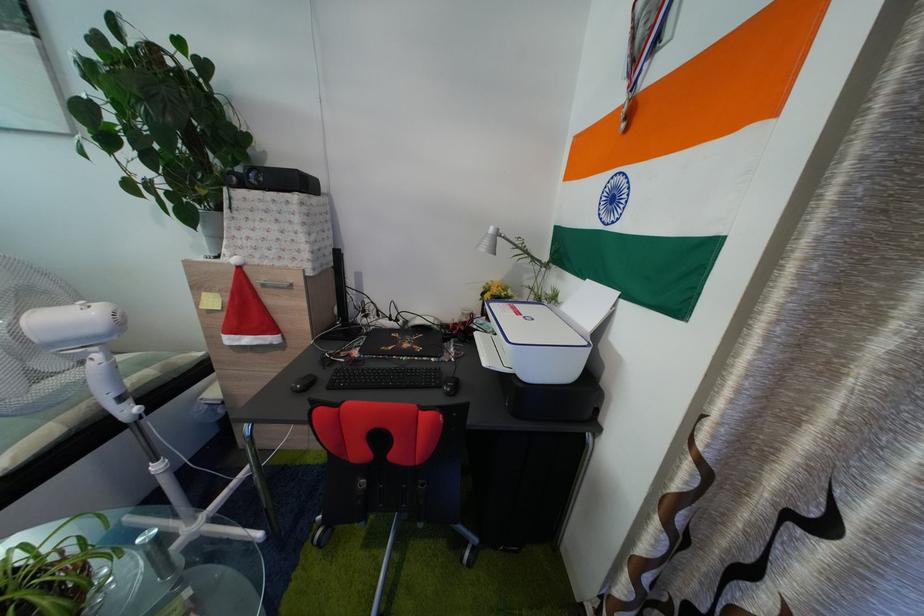
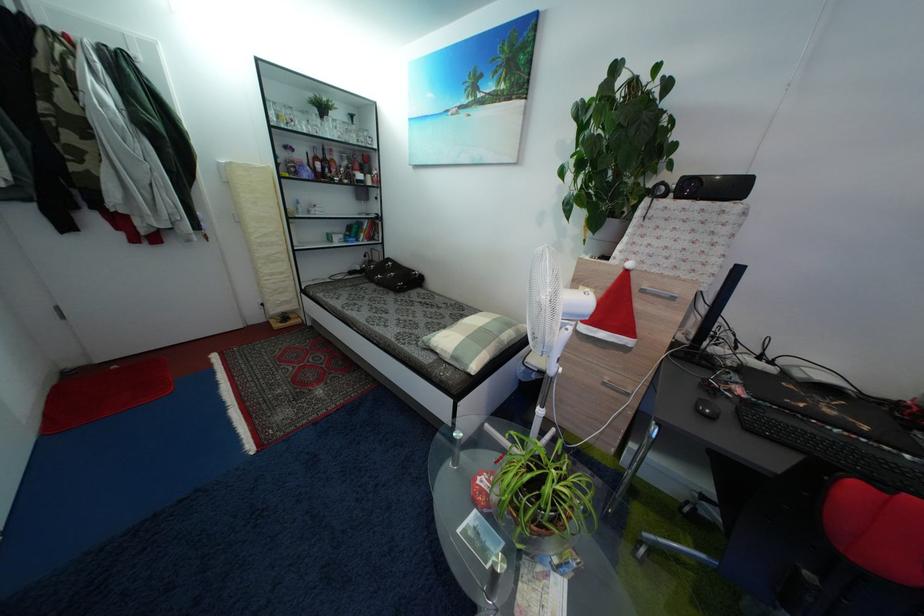
Question: The camera is either moving clockwise (left) or counter-clockwise (right) around the object. The first image is from the beginning of the video and the second image is from the end. Is the camera moving left or right when shooting the video?

Choices:
 (A) Left
 (B) Right

Answer: (B)